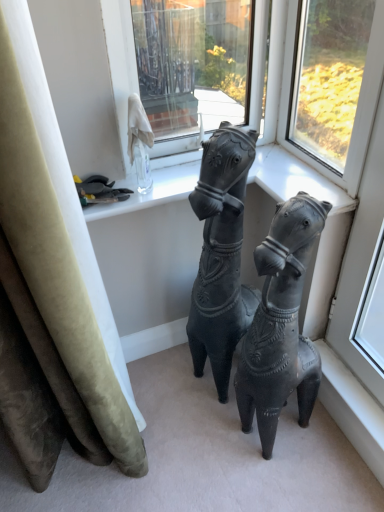
Find the location of a particular element. The image size is (384, 512). vacant area that is in front of matte black horse at center is located at coordinates (285, 478).